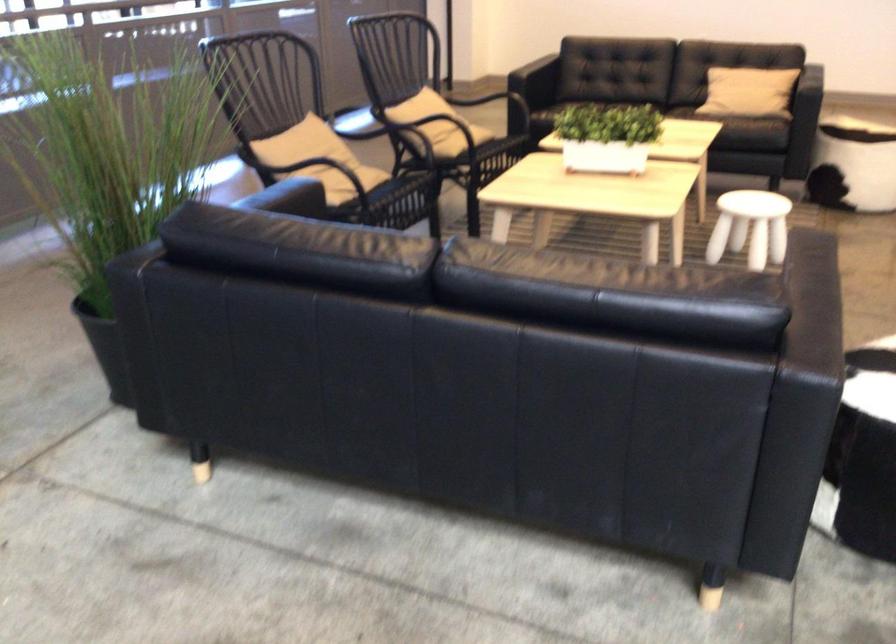
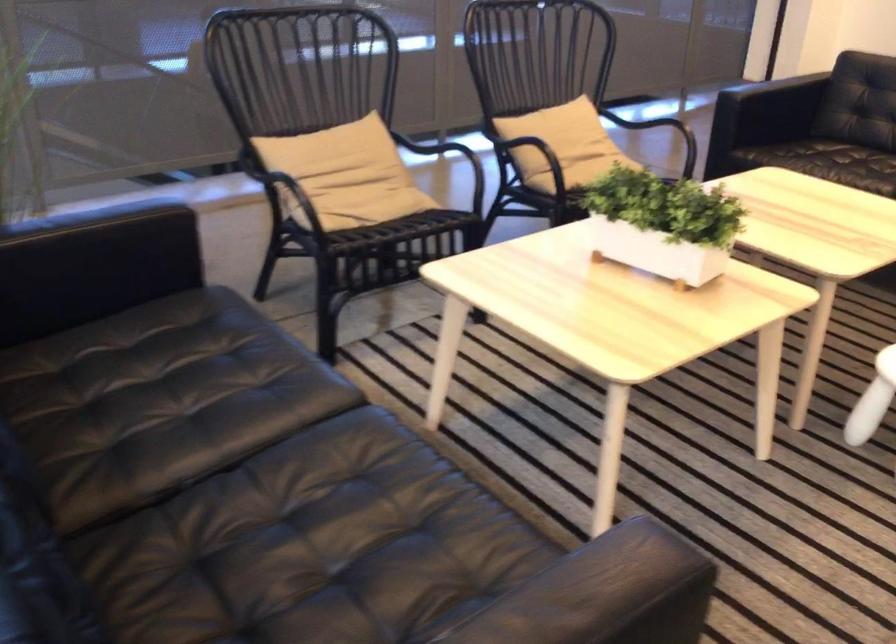
In a continuous first-person perspective shot, in which direction is the camera moving?

The cameraman walked toward right, forward.